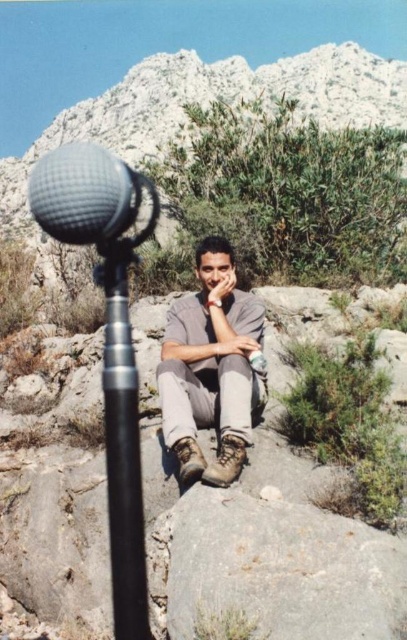
You are a photographer standing 10 feet away from the black metallic pole at center. You want to take a photo of the camera without moving your position. Is the camera within your reach to focus on it?

The black metallic pole at center and camera are 6.63 feet apart. Since you are 10 feet away from the black metallic pole at center, the camera is 6.63 feet away from the pole, so the total distance between you and the camera would be 10 feet plus 6.63 feet, which is 16.63 feet. Most cameras can focus at that distance, so yes, the camera should be in focus.

From the picture: You are a sound engineer setting up equipment for an outdoor recording session. You have a black metallic pole at center and a textured gray microphone at left. The microphone needs to be positioned exactly 4 meters away from the pole for optimal sound quality. Based on the scene, is the current distance sufficient?

The distance between the black metallic pole at center and the textured gray microphone at left is 3.67 meters, which is less than the required 4 meters. Therefore, the microphone needs to be moved further away to achieve the optimal distance.